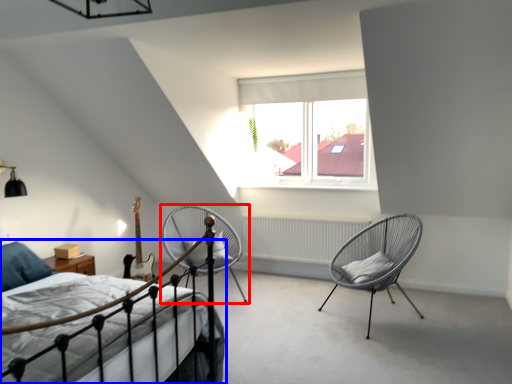
Question: Among these objects, which one is farthest to the camera, chair (highlighted by a red box) or bed (highlighted by a blue box)?

Choices:
 (A) chair
 (B) bed

Answer: (A)